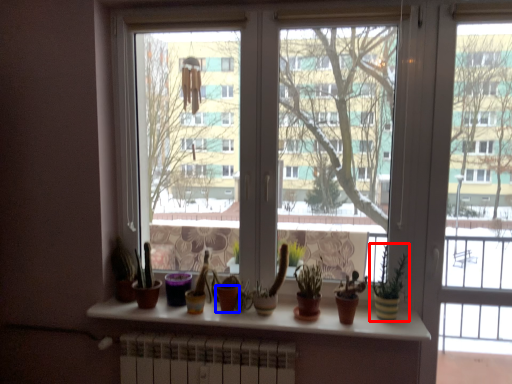
Question: Among these objects, which one is nearest to the camera, houseplant (highlighted by a red box) or flowerpot (highlighted by a blue box)?

Choices:
 (A) houseplant
 (B) flowerpot

Answer: (A)